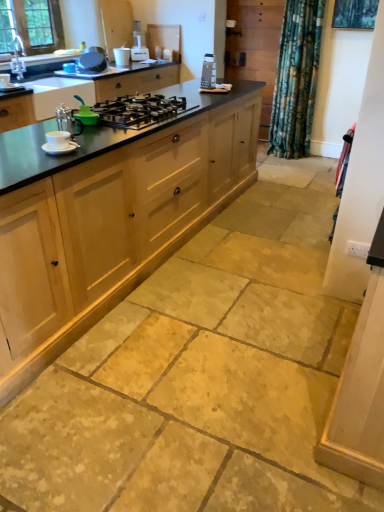
Where is `vacant space to the right of green matte teapot at center-left, placed as the 2th appliance when sorted from right to left`? Image resolution: width=384 pixels, height=512 pixels. vacant space to the right of green matte teapot at center-left, placed as the 2th appliance when sorted from right to left is located at coordinates (120, 128).